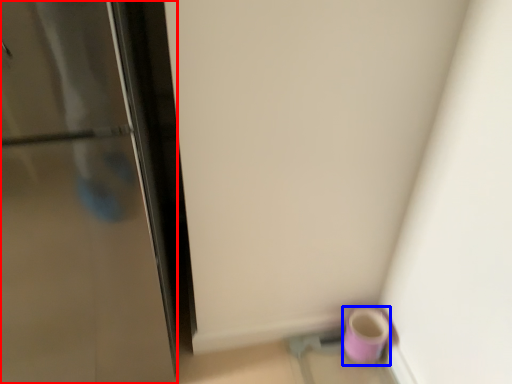
Question: Which point is further to the camera, door (highlighted by a red box) or mug (highlighted by a blue box)?

Choices:
 (A) door
 (B) mug

Answer: (B)